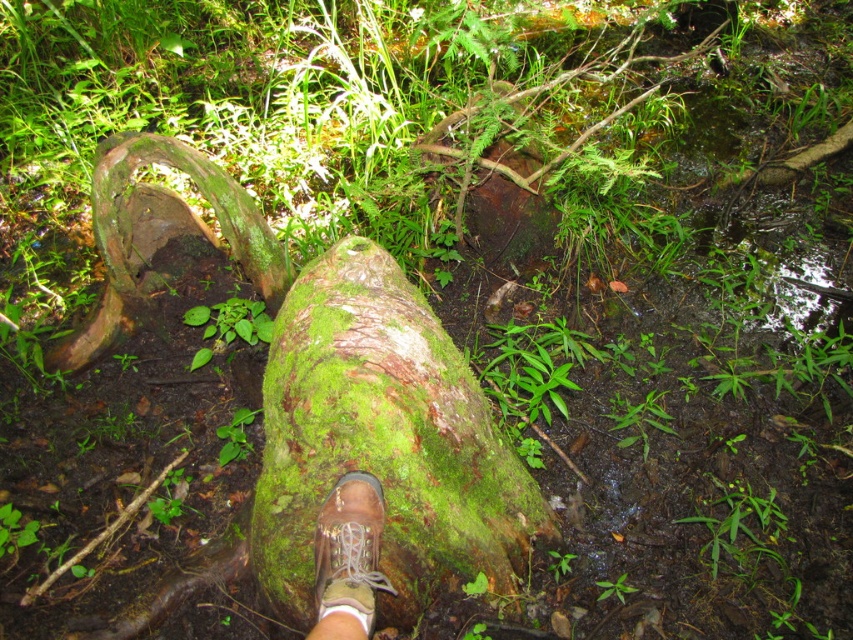
Question: Does green mossy log at center have a larger size compared to brown leather boot at center?

Choices:
 (A) no
 (B) yes

Answer: (B)

Question: Which of the following is the farthest from the observer?

Choices:
 (A) (322, 614)
 (B) (335, 355)

Answer: (B)

Question: Does green mossy log at center appear over brown leather boot at center?

Choices:
 (A) no
 (B) yes

Answer: (B)

Question: Which of the following is the closest to the observer?

Choices:
 (A) (366, 496)
 (B) (277, 497)

Answer: (A)

Question: Is green mossy log at center above brown leather boot at center?

Choices:
 (A) no
 (B) yes

Answer: (B)

Question: Which object is closer to the camera taking this photo?

Choices:
 (A) green mossy log at center
 (B) brown leather boot at center

Answer: (B)